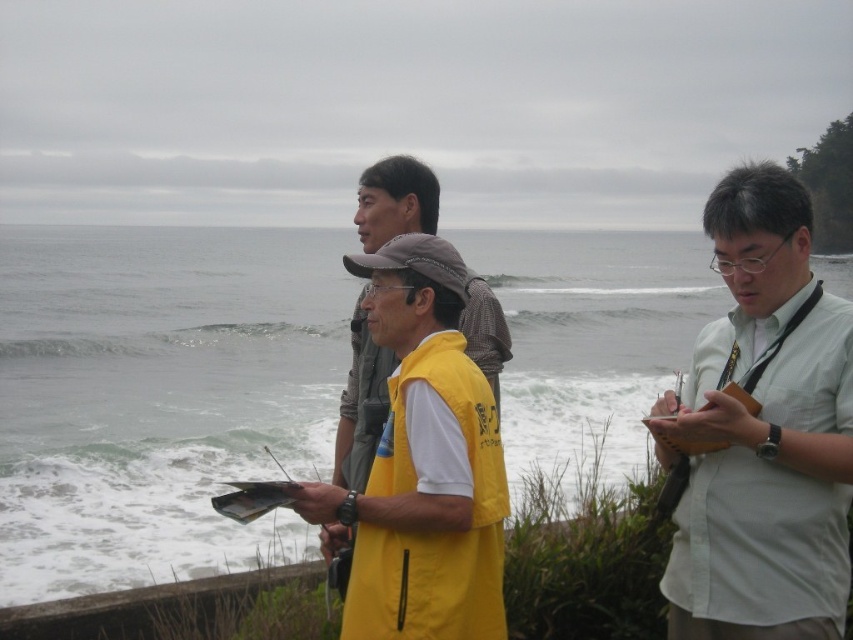
Question: Considering the real-world distances, which object is farthest from the white frothy water at center?

Choices:
 (A) yellow matte vest at center
 (B) white shirt at right

Answer: (B)

Question: Can you confirm if white frothy water at center is thinner than yellow matte vest at center?

Choices:
 (A) yes
 (B) no

Answer: (B)

Question: Which of the following is the farthest from the observer?

Choices:
 (A) white frothy water at center
 (B) yellow matte vest at center

Answer: (A)

Question: Is white shirt at right closer to the viewer compared to yellow matte vest at center?

Choices:
 (A) no
 (B) yes

Answer: (A)

Question: Among these objects, which one is farthest from the camera?

Choices:
 (A) white frothy water at center
 (B) white shirt at right

Answer: (A)

Question: From the image, what is the correct spatial relationship of white frothy water at center in relation to yellow matte vest at center?

Choices:
 (A) below
 (B) above

Answer: (B)